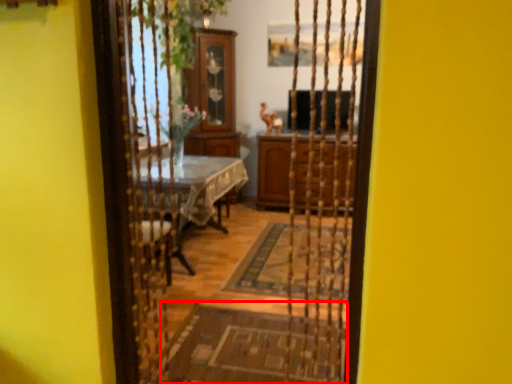
Question: From the image's perspective, where is doormat (annotated by the red box) located in relation to cabinetry in the image?

Choices:
 (A) below
 (B) above

Answer: (A)